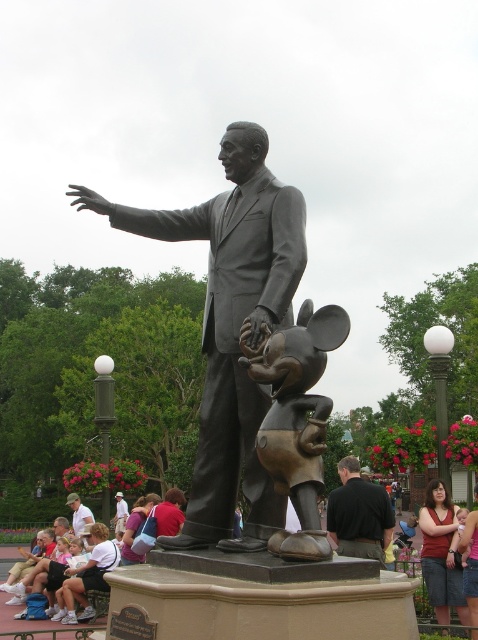
Is matte red dress at lower right shorter than white shirt at lower left?

Indeed, matte red dress at lower right has a lesser height compared to white shirt at lower left.

Is matte red dress at lower right further to camera compared to white shirt at lower left?

That is False.

What do you see at coordinates (442, 554) in the screenshot? The height and width of the screenshot is (640, 478). I see `matte red dress at lower right` at bounding box center [442, 554].

What are the coordinates of `matte red dress at lower right` in the screenshot? It's located at (442, 554).

What do you see at coordinates (230, 326) in the screenshot? I see `bronze statue at center` at bounding box center [230, 326].

Which is in front, point (249, 170) or point (178, 504)?

Point (249, 170) is more forward.

In order to click on bronze statue at center in this screenshot , I will do `click(230, 326)`.

Is bronze mickey mouse at center positioned before white shirt at lower left?

Yes, it is.

Is bronze mickey mouse at center taller than white shirt at lower left?

No.

Which is behind, point (316, 438) or point (76, 493)?

Positioned behind is point (76, 493).

I want to click on bronze mickey mouse at center, so click(295, 419).